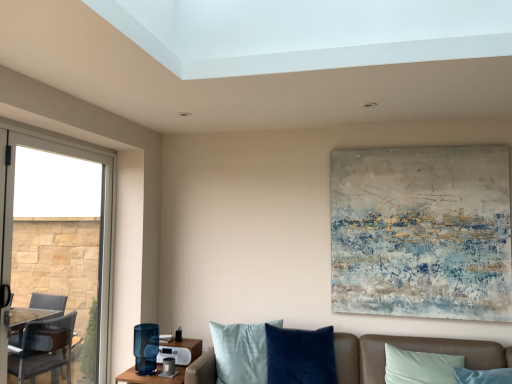
Question: Can you confirm if clear glass window at left is smaller than leather couch at lower right?

Choices:
 (A) yes
 (B) no

Answer: (B)

Question: Is clear glass window at left aimed at leather couch at lower right?

Choices:
 (A) no
 (B) yes

Answer: (B)

Question: Is clear glass window at left located outside leather couch at lower right?

Choices:
 (A) yes
 (B) no

Answer: (A)

Question: Is clear glass window at left to the right of leather couch at lower right from the viewer's perspective?

Choices:
 (A) yes
 (B) no

Answer: (B)

Question: Does clear glass window at left have a larger size compared to leather couch at lower right?

Choices:
 (A) yes
 (B) no

Answer: (A)

Question: Is velvet brown couch at lower center taller or shorter than matte blue glass at lower center?

Choices:
 (A) tall
 (B) short

Answer: (A)

Question: Is velvet brown couch at lower center wider or thinner than matte blue glass at lower center?

Choices:
 (A) wide
 (B) thin

Answer: (A)

Question: From a real-world perspective, is velvet brown couch at lower center above or below matte blue glass at lower center?

Choices:
 (A) below
 (B) above

Answer: (B)

Question: Is velvet brown couch at lower center in front of or behind matte blue glass at lower center in the image?

Choices:
 (A) behind
 (B) front

Answer: (B)

Question: Looking at their shapes, would you say textured canvas painting at upper center is wider or thinner than velvet brown couch at lower center?

Choices:
 (A) wide
 (B) thin

Answer: (B)

Question: Would you say textured canvas painting at upper center is inside or outside velvet brown couch at lower center?

Choices:
 (A) outside
 (B) inside

Answer: (A)

Question: Considering their positions, is textured canvas painting at upper center located in front of or behind velvet brown couch at lower center?

Choices:
 (A) front
 (B) behind

Answer: (B)

Question: Considering the positions of textured canvas painting at upper center and velvet brown couch at lower center in the image, is textured canvas painting at upper center taller or shorter than velvet brown couch at lower center?

Choices:
 (A) tall
 (B) short

Answer: (A)

Question: Based on their sizes in the image, would you say clear glass window at left is bigger or smaller than textured canvas painting at upper center?

Choices:
 (A) small
 (B) big

Answer: (B)

Question: Considering their positions, is clear glass window at left located in front of or behind textured canvas painting at upper center?

Choices:
 (A) behind
 (B) front

Answer: (B)